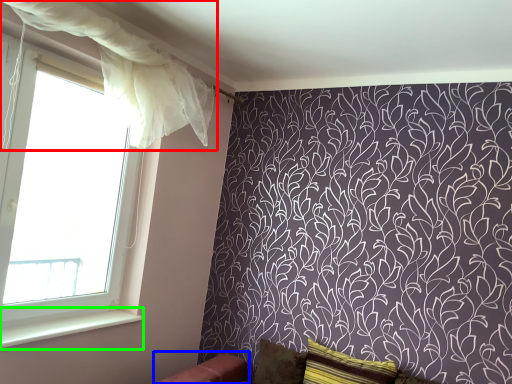
Question: Which object is positioned closest to curtain (highlighted by a red box)? Select from furniture (highlighted by a blue box) and window sill (highlighted by a green box).

Choices:
 (A) furniture
 (B) window sill

Answer: (B)